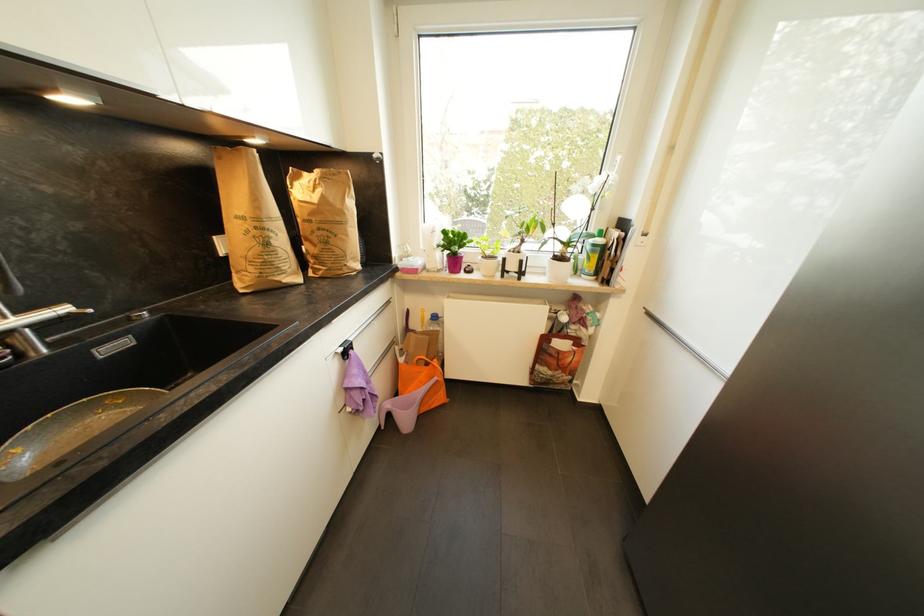
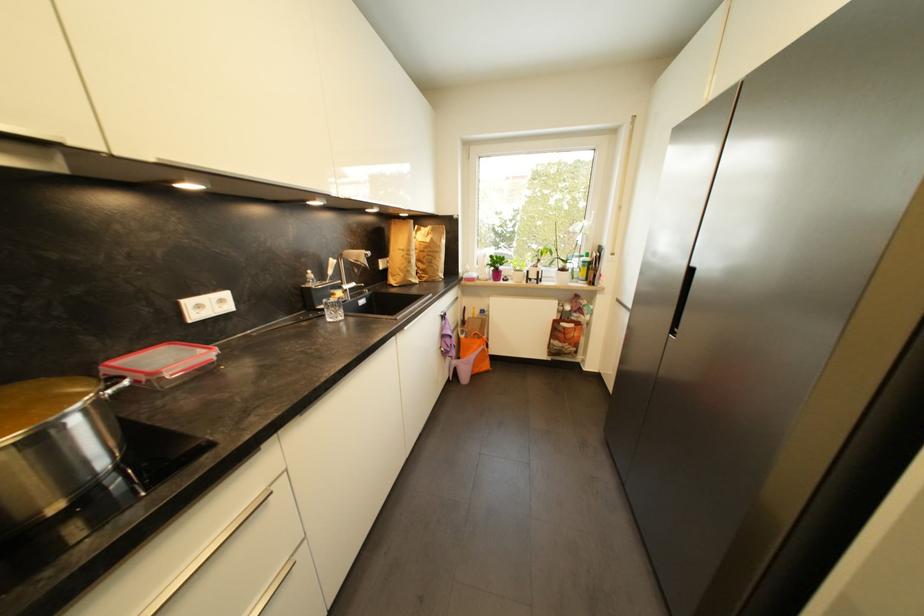
Where in the second image is the point corresponding to the point at 407,362 from the first image?

(468, 339)